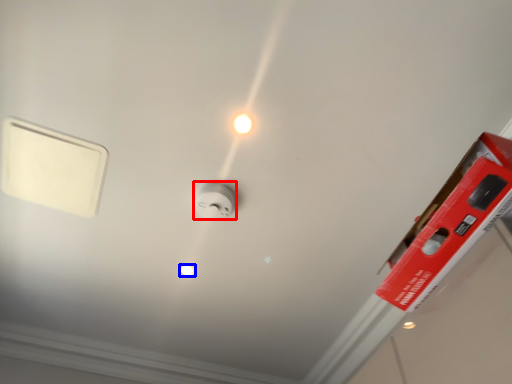
Question: Among these objects, which one is nearest to the camera, power plugs and sockets (highlighted by a red box) or light bulb (highlighted by a blue box)?

Choices:
 (A) power plugs and sockets
 (B) light bulb

Answer: (A)